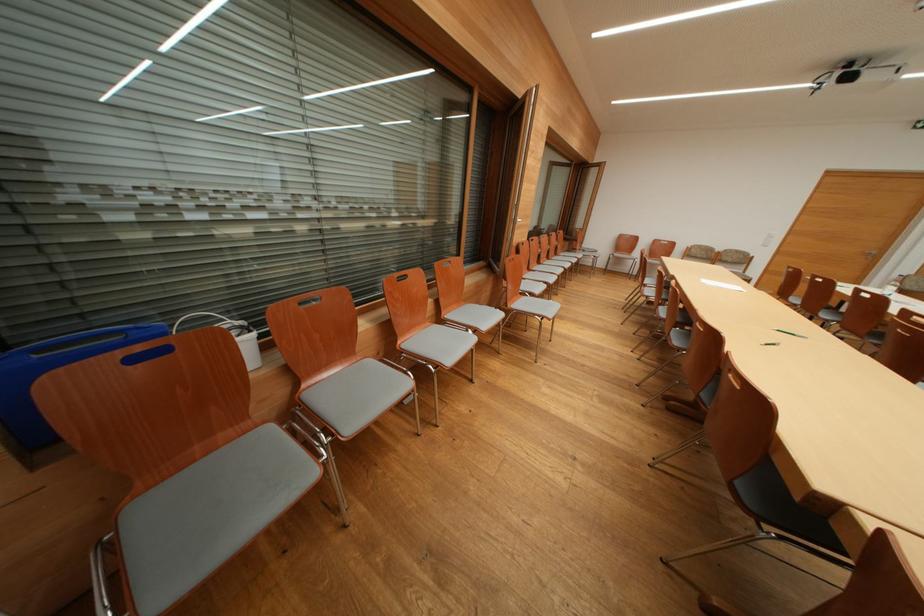
I want to click on window handle, so click(309, 301).